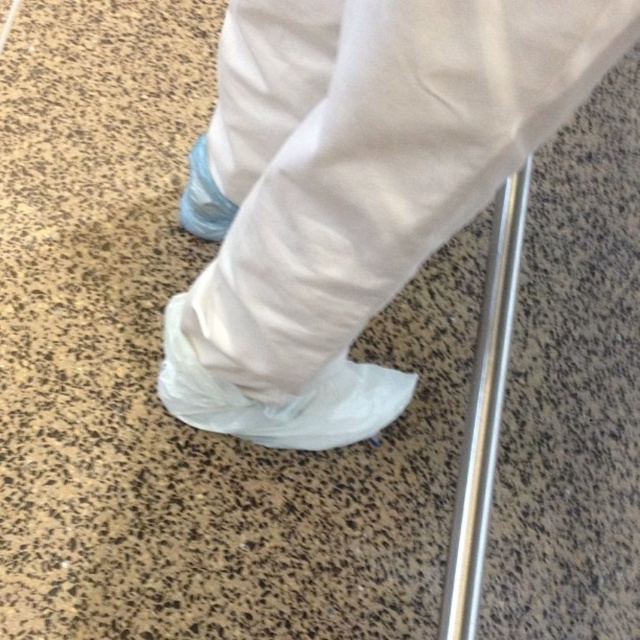
You are a maintenance worker tasked with replacing the shoe covers in a lab. You have a storage box that can only fit items narrower than 12 inches. Based on the scene, can both the white plastic boot at lower center and the blue fabric shoe at lower left fit into the box?

The white plastic boot at lower center might be wider than blue fabric shoe at lower left. Since the box can only fit items narrower than 12 inches, if the white plastic boot at lower center is wider than the blue fabric shoe at lower left, but both are under 12 inches, they can fit. However, if the white plastic boot exceeds 12 inches, it won cannot fit while the blue fabric shoe might still fit.